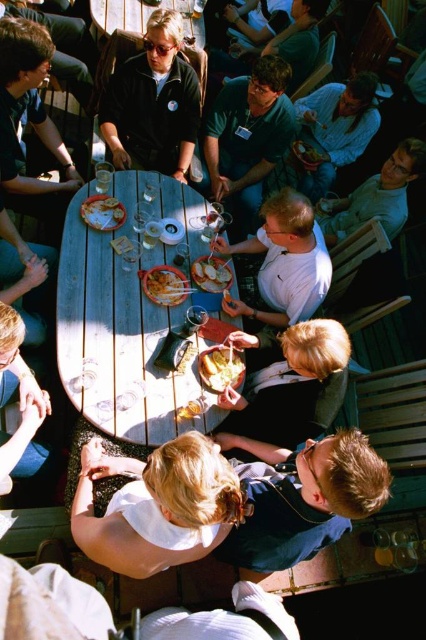
Who is taller, white matte shirt at lower center or golden crispy chips at center?

white matte shirt at lower center is taller.

Who is more distant from viewer, (132, 529) or (216, 390)?

The point (216, 390) is more distant.

Which is behind, point (109, 538) or point (219, 369)?

The point (219, 369) is behind.

The width and height of the screenshot is (426, 640). In order to click on white matte shirt at lower center in this screenshot , I will do `click(155, 506)`.

Does point (296, 426) come farther from viewer compared to point (232, 355)?

No, it is not.

Looking at this image, measure the distance between point (284, 403) and camera.

Point (284, 403) is 8.42 feet from camera.

Between point (256, 346) and point (224, 372), which one is positioned behind?

The point (256, 346) is behind.

You are a GUI agent. You are given a task and a screenshot of the screen. Output one action in this format:
    pyautogui.click(x=<x>, y=<y>)
    Task: Click on the smooth white plate at center
    
    Given the screenshot: What is the action you would take?
    pyautogui.click(x=293, y=387)

Is white matte shirt at lower center behind matte black shirt at left?

No, it is not.

Who is more forward, [81,449] or [16,177]?

Point [81,449] is in front.

Describe the element at coordinates (155, 506) in the screenshot. The width and height of the screenshot is (426, 640). I see `white matte shirt at lower center` at that location.

Locate an element on the screen. The height and width of the screenshot is (640, 426). white matte shirt at lower center is located at coordinates (155, 506).